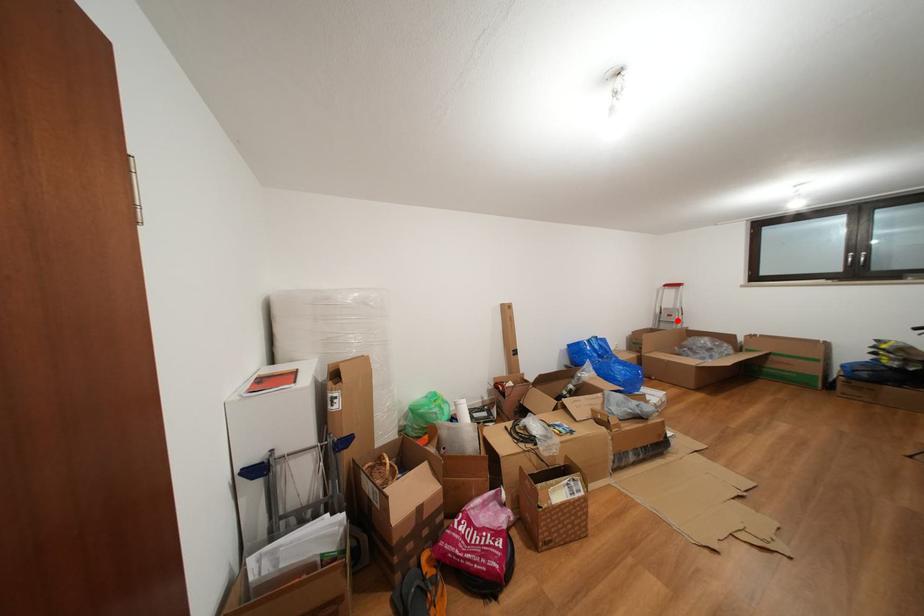
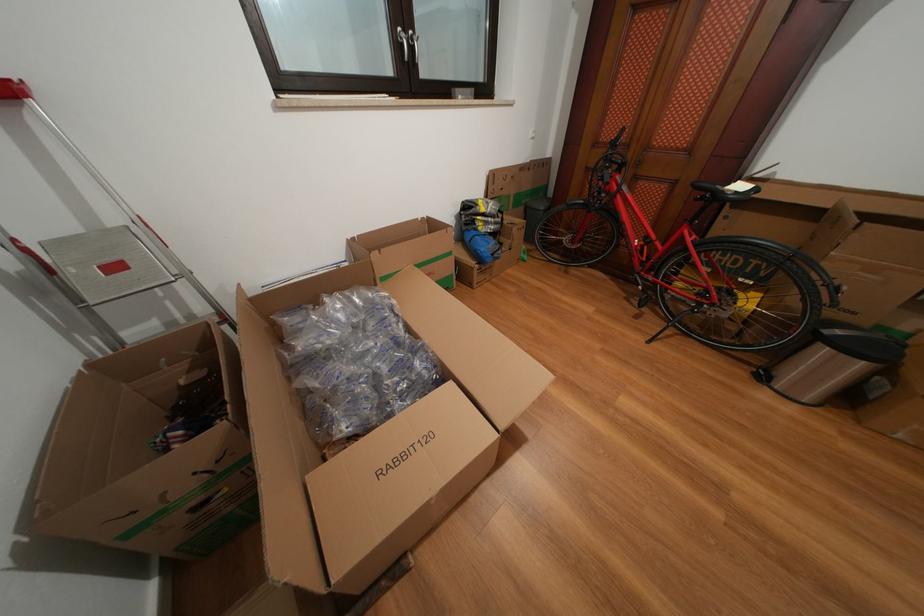
Question: I am providing you with two images of the same scene from different viewpoints. A red point is shown in image1. For the corresponding object point in image2, is it positioned nearer or farther from the camera?

Choices:
 (A) Nearer
 (B) Farther

Answer: (B)